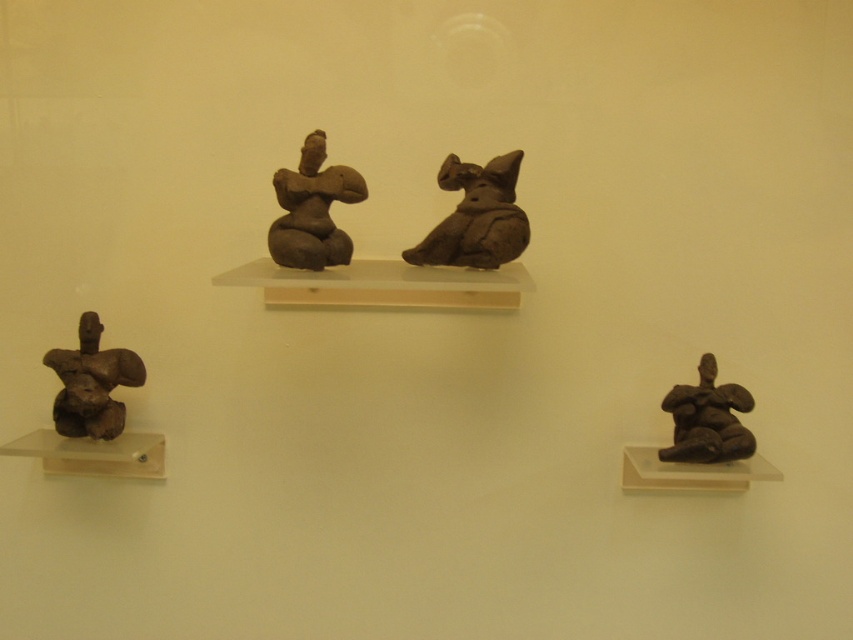
You are an archaeologist examining the display of ancient figurines. You need to determine the spatial relationship between the matte clay figure at center and the matte brown figure at lower right. Based on the scene description, which figurine is placed higher in the arrangement?

The matte clay figure at center is positioned over the matte brown figure at lower right, meaning it is placed higher in the arrangement.

You are an art curator examining the two figurines in the image. The matte clay cat at center and the matte brown statue at lower left are both on display. Based on their positions, which one would appear larger to a visitor standing directly in front of the display?

The matte clay cat at center appears larger because it is closer to the viewer than the matte brown statue at lower left.